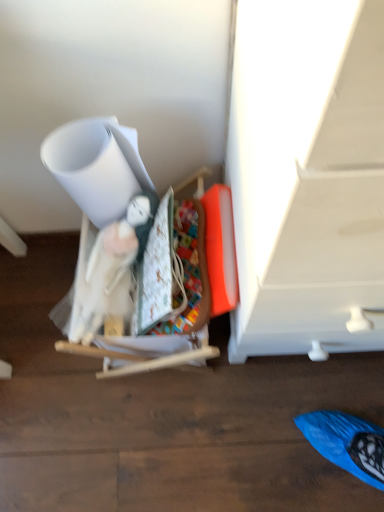
Question: Should I look upward or downward to see white fabric doll at left?

Choices:
 (A) down
 (B) up

Answer: (A)